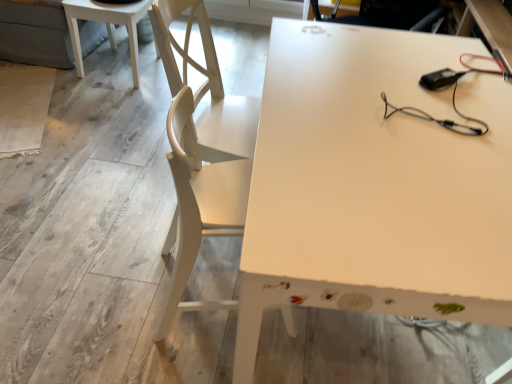
Question: Considering the relative positions of white glossy table at upper left, the 2th table in the right-to-left sequence, and white matte table at center, the 1th table positioned from the front, in the image provided, is white glossy table at upper left, the 2th table in the right-to-left sequence, to the left or to the right of white matte table at center, the 1th table positioned from the front,?

Choices:
 (A) right
 (B) left

Answer: (B)

Question: Considering their positions, is white glossy table at upper left, the first table positioned from the left, located in front of or behind white matte table at center, which is counted as the second table, starting from the left?

Choices:
 (A) front
 (B) behind

Answer: (B)

Question: Estimate the real-world distances between objects in this image. Which object is closer to the white matte table at center, which is the second table from back to front?

Choices:
 (A) white wood chair at left
 (B) white glossy table at upper left, the 2th table in the right-to-left sequence

Answer: (A)

Question: Which is farther from the white wood chair at left?

Choices:
 (A) white glossy table at upper left, acting as the first table starting from the back
 (B) white matte table at center, which is the second table from back to front

Answer: (A)